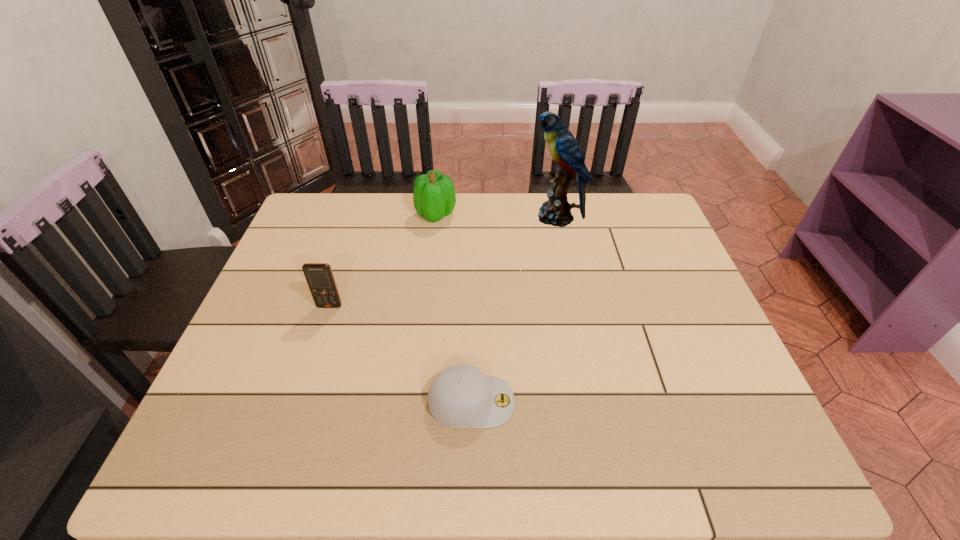
I want to click on parrot, so click(x=564, y=149).

Identify the location of the tallest object. The height and width of the screenshot is (540, 960). (564, 149).

You are a GUI agent. You are given a task and a screenshot of the screen. Output one action in this format:
    pyautogui.click(x=<x>, y=<y>)
    Task: Click on the bell pepper
    
    Given the screenshot: What is the action you would take?
    pyautogui.click(x=434, y=197)

This screenshot has height=540, width=960. Identify the location of cellular telephone. (319, 276).

Identify the location of the leftmost object. The width and height of the screenshot is (960, 540). (319, 276).

This screenshot has width=960, height=540. What are the coordinates of `cap` in the screenshot? It's located at (461, 396).

The height and width of the screenshot is (540, 960). In order to click on the shortest object in this screenshot , I will do `click(461, 396)`.

I want to click on blank space located 0.310m on the face of the tallest object, so click(433, 217).

Identify the location of free space located on the face of the tallest object. (x=502, y=217).

Find the location of `vacant region located on the face of the tallest object`. vacant region located on the face of the tallest object is located at coordinates (455, 217).